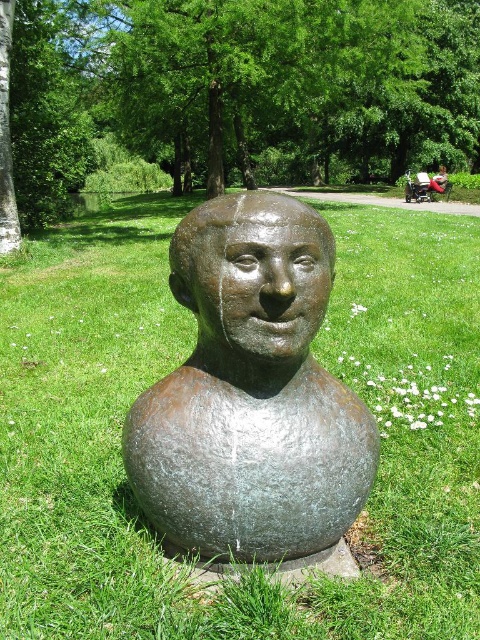
Describe the element at coordinates (180, 364) in the screenshot. The height and width of the screenshot is (640, 480). I see `green grass at center` at that location.

Is green grass at center to the right of green leafy tree at center from the viewer's perspective?

In fact, green grass at center is to the left of green leafy tree at center.

What do you see at coordinates (180, 364) in the screenshot? Image resolution: width=480 pixels, height=640 pixels. I see `green grass at center` at bounding box center [180, 364].

Find the location of a particular element. The width and height of the screenshot is (480, 640). green grass at center is located at coordinates (180, 364).

Does point (82, 262) come behind point (312, 273)?

That is True.

Which of these two, green grass at center or rusty bronze head at center, stands shorter?

Standing shorter between the two is rusty bronze head at center.

Does point (451, 387) come closer to viewer compared to point (244, 234)?

No, (451, 387) is further to viewer.

Where is `green grass at center`? The height and width of the screenshot is (640, 480). green grass at center is located at coordinates (180, 364).

Does green grass at center have a greater width compared to bronze statue at center?

Indeed, green grass at center has a greater width compared to bronze statue at center.

This screenshot has height=640, width=480. What are the coordinates of `green grass at center` in the screenshot? It's located at (180, 364).